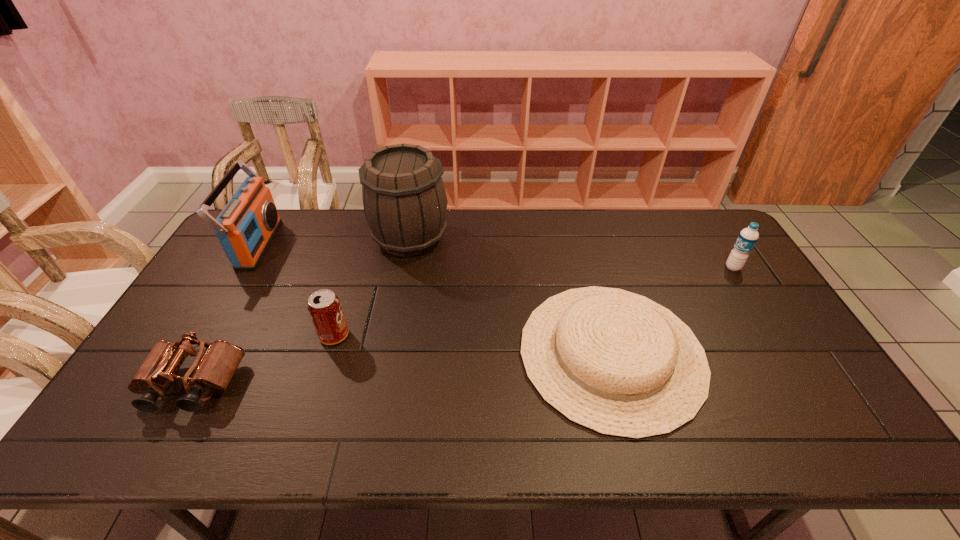
Where is `the fifth closest object to the tallest object`? This screenshot has width=960, height=540. the fifth closest object to the tallest object is located at coordinates (748, 237).

What are the coordinates of `free space in the image that satisfies the following two spatial constraints: 1. on the label of the fourth shortest object; 2. through the eyepieces of the fifth tallest object` in the screenshot? It's located at (806, 385).

At what (x,y) coordinates should I click in order to perform the action: click on blank space that satisfies the following two spatial constraints: 1. on the front-facing side of the soda can; 2. on the right side of the fifth shortest object. Please return your answer as a coordinate pair (x, y). This screenshot has width=960, height=540. Looking at the image, I should click on (205, 335).